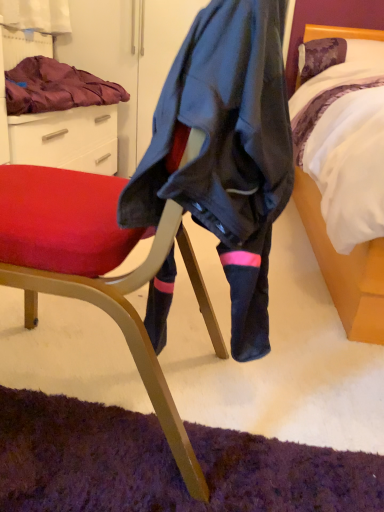
Question: Does white satin bed at right have a larger size compared to velvet purple blanket at upper left?

Choices:
 (A) yes
 (B) no

Answer: (A)

Question: Are white satin bed at right and velvet purple blanket at upper left far apart?

Choices:
 (A) no
 (B) yes

Answer: (B)

Question: Is white satin bed at right positioned with its back to velvet purple blanket at upper left?

Choices:
 (A) yes
 (B) no

Answer: (B)

Question: Is white satin bed at right wider than velvet purple blanket at upper left?

Choices:
 (A) yes
 (B) no

Answer: (A)

Question: Can you confirm if white satin bed at right is taller than velvet purple blanket at upper left?

Choices:
 (A) no
 (B) yes

Answer: (B)

Question: Considering the relative positions of white satin bed at right and velvet purple blanket at upper left in the image provided, is white satin bed at right to the left of velvet purple blanket at upper left from the viewer's perspective?

Choices:
 (A) yes
 (B) no

Answer: (B)

Question: Is white satin bed at right far away from matte black chair at center?

Choices:
 (A) no
 (B) yes

Answer: (A)

Question: Is white satin bed at right not inside matte black chair at center?

Choices:
 (A) no
 (B) yes

Answer: (B)

Question: Can you confirm if white satin bed at right is positioned to the left of matte black chair at center?

Choices:
 (A) yes
 (B) no

Answer: (B)

Question: From a real-world perspective, is white satin bed at right under matte black chair at center?

Choices:
 (A) yes
 (B) no

Answer: (B)

Question: From the image's perspective, is white satin bed at right above matte black chair at center?

Choices:
 (A) no
 (B) yes

Answer: (B)

Question: Is white satin bed at right thinner than matte black chair at center?

Choices:
 (A) no
 (B) yes

Answer: (A)

Question: Can you confirm if matte black chair at center is smaller than white satin bed at right?

Choices:
 (A) yes
 (B) no

Answer: (A)